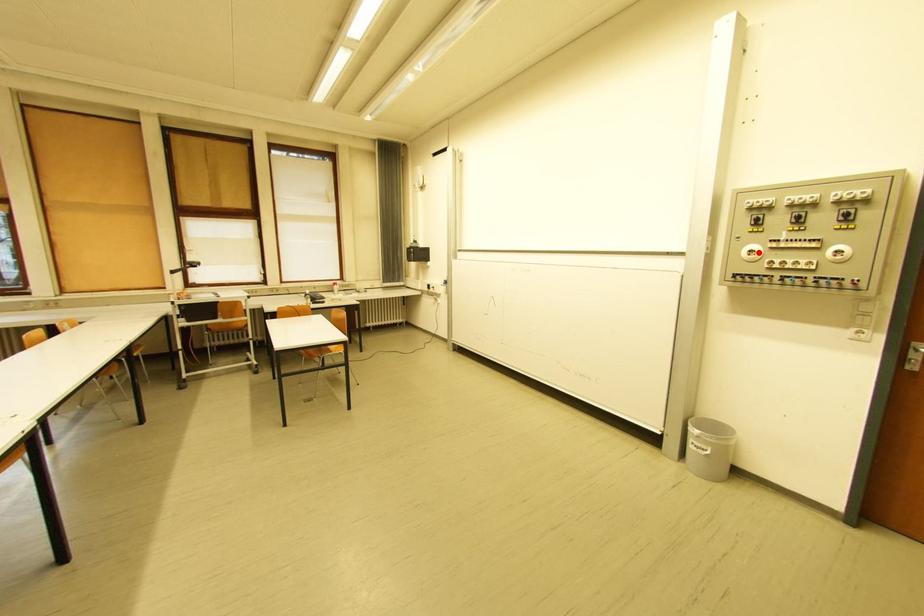
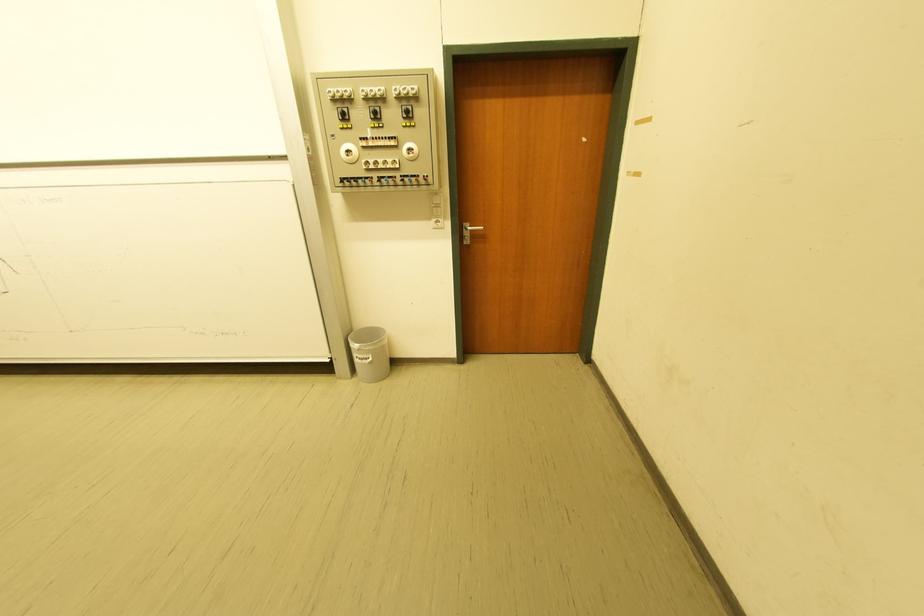
Where in the second image is the point corresponding to the highlighted location from the first image?

(355, 153)